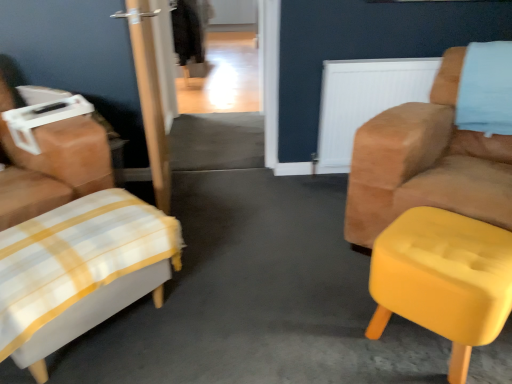
Question: Looking at the image, does white plaid ottoman at lower left, the second furniture from the right, seem bigger or smaller compared to white fabric ottoman at left, which ranks as the second chair in right-to-left order?

Choices:
 (A) big
 (B) small

Answer: (B)

Question: Would you say white plaid ottoman at lower left, which is counted as the 1th furniture, starting from the left, is to the left or to the right of white fabric ottoman at left, placed as the first chair when sorted from left to right, in the picture?

Choices:
 (A) left
 (B) right

Answer: (B)

Question: Estimate the real-world distances between objects in this image. Which object is closer to the yellow fabric ottoman at right, which appears as the first furniture when viewed from the right?

Choices:
 (A) white fabric ottoman at left, which ranks as the second chair in right-to-left order
 (B) suede tan armchair at right, which ranks as the second chair in left-to-right order
 (C) white plaid ottoman at lower left, the second furniture from the right
 (D) white textured radiator at upper right

Answer: (B)

Question: Which is farther from the suede tan armchair at right, the 1th chair when ordered from right to left?

Choices:
 (A) yellow fabric ottoman at right, which appears as the first furniture when viewed from the right
 (B) white plaid ottoman at lower left, the second furniture from the right
 (C) white fabric ottoman at left, placed as the first chair when sorted from left to right
 (D) white textured radiator at upper right

Answer: (C)